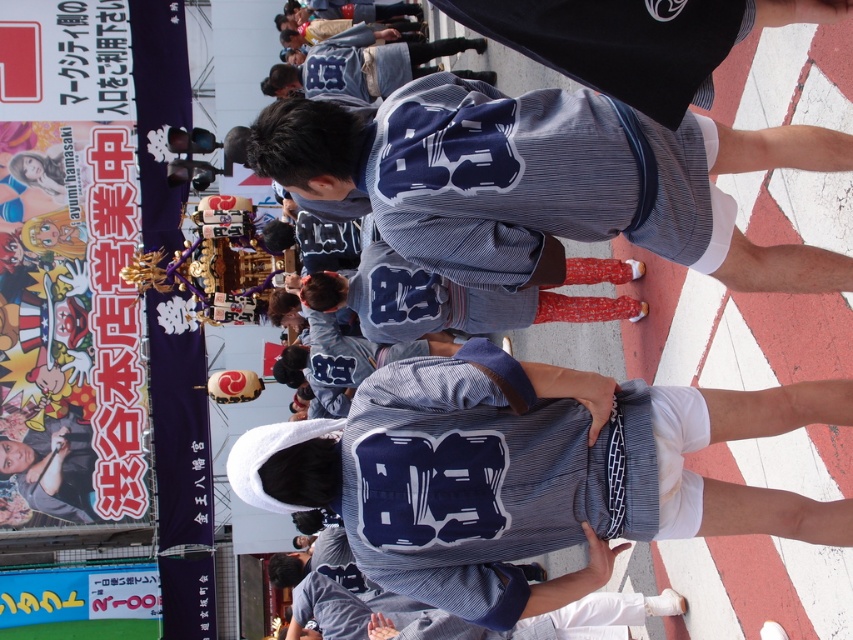
Question: From the image, what is the correct spatial relationship of striped fabric shirt at center in relation to striped fabric kimono at center?

Choices:
 (A) left
 (B) right

Answer: (A)

Question: Which point is closer to the camera?

Choices:
 (A) pos(697,422)
 (B) pos(831,141)

Answer: (B)

Question: Does striped fabric shirt at center appear over striped fabric kimono at center?

Choices:
 (A) yes
 (B) no

Answer: (B)

Question: Is striped fabric shirt at center bigger than striped fabric kimono at center?

Choices:
 (A) no
 (B) yes

Answer: (A)